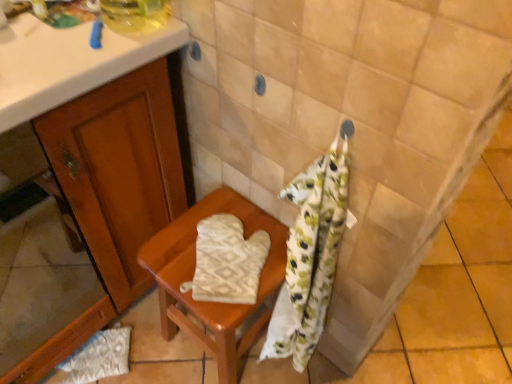
You are a GUI agent. You are given a task and a screenshot of the screen. Output one action in this format:
    pyautogui.click(x=<x>, y=<y>)
    Task: Click on the vacant area that lies to the right of white textured oven mitt at lower left
    The image size is (512, 384).
    Given the screenshot: What is the action you would take?
    pyautogui.click(x=166, y=360)